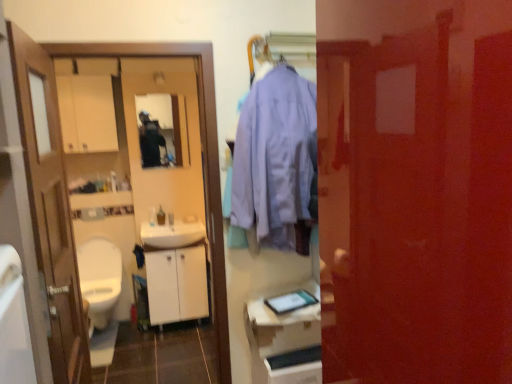
The height and width of the screenshot is (384, 512). What do you see at coordinates (159, 130) in the screenshot?
I see `matte black mirror at upper center` at bounding box center [159, 130].

Locate an element on the screen. This screenshot has height=384, width=512. wooden door at left, positioned as the second door in front-to-back order is located at coordinates click(x=50, y=207).

Describe the element at coordinates (415, 190) in the screenshot. I see `matte red door at center, the first door positioned from the right` at that location.

What do you see at coordinates (279, 314) in the screenshot? The width and height of the screenshot is (512, 384). I see `matte black tablet at center` at bounding box center [279, 314].

Locate an element on the screen. The height and width of the screenshot is (384, 512). matte black tablet at center is located at coordinates (279, 314).

Locate an element on the screen. This screenshot has width=512, height=384. white matte cabinet at center, marked as the first cabinetry in a left-to-right arrangement is located at coordinates (177, 285).

Based on the photo, would you say wooden door at left, the first door in the left-to-right sequence, contains translucent plastic bottle at center?

No, translucent plastic bottle at center is not a part of wooden door at left, the first door in the left-to-right sequence.

From a real-world perspective, between wooden door at left, the first door from the back, and translucent plastic bottle at center, who is vertically lower?

translucent plastic bottle at center, from a real-world perspective.

Consider the image. Considering the relative sizes of wooden door at left, positioned as the second door in front-to-back order, and translucent plastic bottle at center in the image provided, is wooden door at left, positioned as the second door in front-to-back order, shorter than translucent plastic bottle at center?

In fact, wooden door at left, positioned as the second door in front-to-back order, may be taller than translucent plastic bottle at center.

This screenshot has width=512, height=384. Identify the location of toiletry on the right of wooden door at left, the first door from the back. (161, 216).

From the image's perspective, does white glossy toilet at lower left appear lower than white matte cabinet at center, positioned as the second cabinetry in front-to-back order?

Incorrect, from the image's perspective, white glossy toilet at lower left is higher than white matte cabinet at center, positioned as the second cabinetry in front-to-back order.

Is white glossy toilet at lower left bigger or smaller than white matte cabinet at center, positioned as the second cabinetry in front-to-back order?

white glossy toilet at lower left is bigger than white matte cabinet at center, positioned as the second cabinetry in front-to-back order.

Is white glossy toilet at lower left oriented towards white matte cabinet at center, marked as the first cabinetry in a left-to-right arrangement?

No, white glossy toilet at lower left is not turned towards white matte cabinet at center, marked as the first cabinetry in a left-to-right arrangement.

How far apart are white glossy toilet at lower left and white matte cabinet at center, positioned as the first cabinetry in back-to-front order?

They are 19.12 inches apart.

How many degrees apart are the facing directions of white glossy toilet at lower left and translucent plastic bottle at center?

The angular difference between white glossy toilet at lower left and translucent plastic bottle at center is 0.0914 degrees.

Considering the positions of points (78, 259) and (161, 221), is point (78, 259) closer to camera compared to point (161, 221)?

Yes, point (78, 259) is closer to viewer.

Is white glossy toilet at lower left oriented away from translucent plastic bottle at center?

That's not correct — white glossy toilet at lower left is not looking away from translucent plastic bottle at center.

Does white glossy toilet at lower left have a greater height compared to translucent plastic bottle at center?

Indeed, white glossy toilet at lower left has a greater height compared to translucent plastic bottle at center.

Between point (92, 322) and point (85, 123), which one is positioned in front?

Positioned in front is point (92, 322).

From the image's perspective, which one is positioned lower, white glossy toilet at lower left or white glossy medicine cabinet at upper left?

white glossy toilet at lower left.

Is white glossy toilet at lower left positioned in front of white glossy medicine cabinet at upper left?

Yes, it is in front of white glossy medicine cabinet at upper left.

Is white glossy toilet at lower left thinner than white glossy medicine cabinet at upper left?

In fact, white glossy toilet at lower left might be wider than white glossy medicine cabinet at upper left.

From a real-world perspective, does white glossy cabinet at lower center, which is the 2th cabinetry from left to right, stand above white glossy medicine cabinet at upper left?

No, from a real-world perspective, white glossy cabinet at lower center, which is the 2th cabinetry from left to right, is not over white glossy medicine cabinet at upper left

Which object is closer to the camera taking this photo, white glossy cabinet at lower center, acting as the 1th cabinetry starting from the front, or white glossy medicine cabinet at upper left?

Positioned in front is white glossy cabinet at lower center, acting as the 1th cabinetry starting from the front.

Which object is positioned more to the right, white glossy cabinet at lower center, the 2th cabinetry positioned from the back, or white glossy medicine cabinet at upper left?

white glossy cabinet at lower center, the 2th cabinetry positioned from the back, is more to the right.

In the scene shown: Does white glossy cabinet at lower center, acting as the 1th cabinetry starting from the front, have a larger size compared to white glossy medicine cabinet at upper left?

Actually, white glossy cabinet at lower center, acting as the 1th cabinetry starting from the front, might be smaller than white glossy medicine cabinet at upper left.

Who is smaller, white glossy toilet at lower left or white glossy sink at center?

white glossy sink at center is smaller.

Can you tell me how much white glossy toilet at lower left and white glossy sink at center differ in facing direction?

The facing directions of white glossy toilet at lower left and white glossy sink at center are 1.75 degrees apart.

From a real-world perspective, relative to white glossy sink at center, is white glossy toilet at lower left vertically above or below?

white glossy toilet at lower left is situated lower than white glossy sink at center in the real world.

Is white glossy cabinet at lower center, which is the 2th cabinetry from left to right, turned away from matte black tablet at center?

No, white glossy cabinet at lower center, which is the 2th cabinetry from left to right, is not facing the opposite direction of matte black tablet at center.

Considering the positions of objects white glossy cabinet at lower center, acting as the 1th cabinetry starting from the front, and matte black tablet at center in the image provided, who is behind, white glossy cabinet at lower center, acting as the 1th cabinetry starting from the front, or matte black tablet at center?

Positioned behind is matte black tablet at center.

Based on their positions, is white glossy cabinet at lower center, which ranks as the first cabinetry in right-to-left order, located to the left or right of matte black tablet at center?

In the image, white glossy cabinet at lower center, which ranks as the first cabinetry in right-to-left order, appears on the right side of matte black tablet at center.

From a real-world perspective, is white glossy cabinet at lower center, the 2th cabinetry positioned from the back, located higher than matte black tablet at center?

No, from a real-world perspective, white glossy cabinet at lower center, the 2th cabinetry positioned from the back, is not on top of matte black tablet at center.

Locate an element on the screen. The image size is (512, 384). toiletry behind the wooden door at left, positioned as the second door in front-to-back order is located at coordinates (161, 216).

Where is `toilet lying in front of the white matte cabinet at center, positioned as the second cabinetry in front-to-back order`? toilet lying in front of the white matte cabinet at center, positioned as the second cabinetry in front-to-back order is located at coordinates (100, 279).

Considering their positions, is white matte cabinet at center, positioned as the second cabinetry in front-to-back order, positioned further to matte black tablet at center than white glossy toilet at lower left?

white glossy toilet at lower left lies further to matte black tablet at center than the other object.

Estimate the real-world distances between objects in this image. Which object is further from matte red door at center, arranged as the 2th door when viewed from the left, matte black tablet at center or white glossy sink at center?

white glossy sink at center is further to matte red door at center, arranged as the 2th door when viewed from the left.

Looking at the image, which one is located further to white glossy sink at center, translucent plastic bottle at center or matte black mirror at upper center?

matte black mirror at upper center.

Based on their spatial positions, is white matte cabinet at center, positioned as the second cabinetry in front-to-back order, or matte black tablet at center closer to matte red door at center, arranged as the 2th door when viewed from the left?

Based on the image, matte black tablet at center appears to be nearer to matte red door at center, arranged as the 2th door when viewed from the left.

When comparing their distances from white matte cabinet at center, the 2th cabinetry viewed from the right, does wooden door at left, the first door in the left-to-right sequence, or matte red door at center, arranged as the 2th door when viewed from the left, seem further?

matte red door at center, arranged as the 2th door when viewed from the left, is further to white matte cabinet at center, the 2th cabinetry viewed from the right.

Estimate the real-world distances between objects in this image. Which object is closer to matte black tablet at center, matte black mirror at upper center or white glossy sink at center?

white glossy sink at center lies closer to matte black tablet at center than the other object.

Which object lies further to the anchor point matte black tablet at center, white glossy cabinet at lower center, the 2th cabinetry positioned from the back, or matte black mirror at upper center?

Based on the image, matte black mirror at upper center appears to be further to matte black tablet at center.

From the picture: Based on their spatial positions, is matte red door at center, which is the first door in front-to-back order, or white glossy sink at center closer to white glossy medicine cabinet at upper left?

Among the two, white glossy sink at center is located nearer to white glossy medicine cabinet at upper left.

This screenshot has width=512, height=384. I want to click on cabinetry located between matte red door at center, which is the first door in front-to-back order, and white matte cabinet at center, marked as the first cabinetry in a left-to-right arrangement, in the depth direction, so click(x=283, y=342).

Locate an element on the screen. This screenshot has height=384, width=512. toilet between matte black mirror at upper center and white matte cabinet at center, the 2th cabinetry viewed from the right, vertically is located at coordinates (100, 279).

Locate an element on the screen. counter top located between wooden door at left, the second door in the right-to-left sequence, and white glossy medicine cabinet at upper left in the depth direction is located at coordinates (279, 314).

Find the location of a particular element. counter top between white glossy cabinet at lower center, acting as the 1th cabinetry starting from the front, and white matte cabinet at center, the 2th cabinetry viewed from the right, along the z-axis is located at coordinates (279, 314).